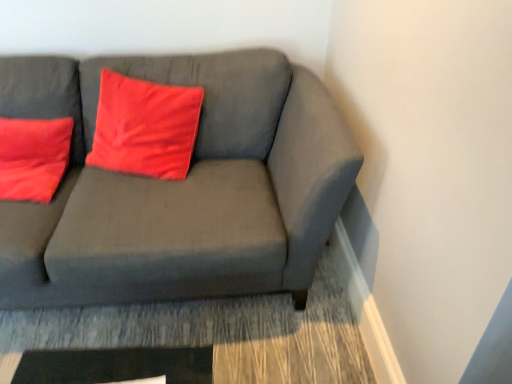
Question: Is matte red pillow at center completely or partially inside matte gray couch at center?

Choices:
 (A) yes
 (B) no

Answer: (A)

Question: Is matte red pillow at center at the back of matte gray couch at center?

Choices:
 (A) no
 (B) yes

Answer: (B)

Question: Does matte gray couch at center have a lesser height compared to matte red pillow at center?

Choices:
 (A) yes
 (B) no

Answer: (B)

Question: Does matte gray couch at center have a lesser width compared to matte red pillow at center?

Choices:
 (A) no
 (B) yes

Answer: (A)

Question: From a real-world perspective, is matte gray couch at center located higher than matte red pillow at center?

Choices:
 (A) yes
 (B) no

Answer: (B)

Question: Is matte gray couch at center not close to matte red pillow at center?

Choices:
 (A) yes
 (B) no

Answer: (B)

Question: Is matte red pillow at center far from matte gray couch at center?

Choices:
 (A) no
 (B) yes

Answer: (A)

Question: From the image's perspective, is matte red pillow at center above matte gray couch at center?

Choices:
 (A) yes
 (B) no

Answer: (A)

Question: Does matte red pillow at center have a greater width compared to matte gray couch at center?

Choices:
 (A) yes
 (B) no

Answer: (B)

Question: Considering the relative positions of matte red pillow at center and matte gray couch at center in the image provided, is matte red pillow at center to the right of matte gray couch at center from the viewer's perspective?

Choices:
 (A) yes
 (B) no

Answer: (A)

Question: Can you confirm if matte red pillow at center is bigger than matte gray couch at center?

Choices:
 (A) no
 (B) yes

Answer: (A)

Question: Can you confirm if matte red pillow at center is smaller than matte gray couch at center?

Choices:
 (A) no
 (B) yes

Answer: (B)

Question: Choose the correct answer: Is matte red pillow at center inside matte gray couch at center or outside it?

Choices:
 (A) inside
 (B) outside

Answer: (A)